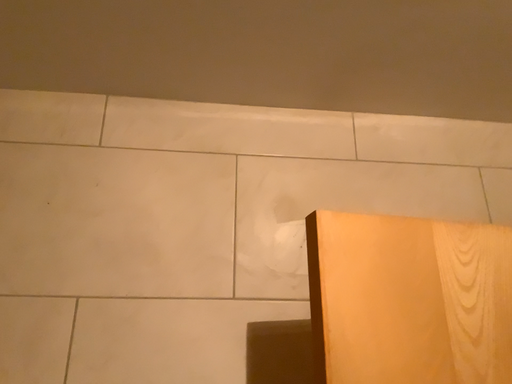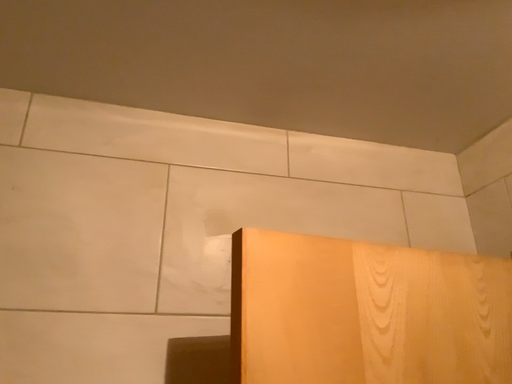
Question: Which way did the camera rotate in the video?

Choices:
 (A) rotated left
 (B) rotated right

Answer: (B)